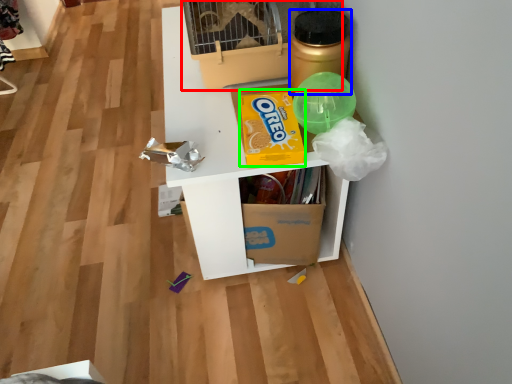
Question: Considering the real-world distances, which object is farthest from bird cage (highlighted by a red box)? bottle (highlighted by a blue box) or cereal (highlighted by a green box)?

Choices:
 (A) bottle
 (B) cereal

Answer: (B)